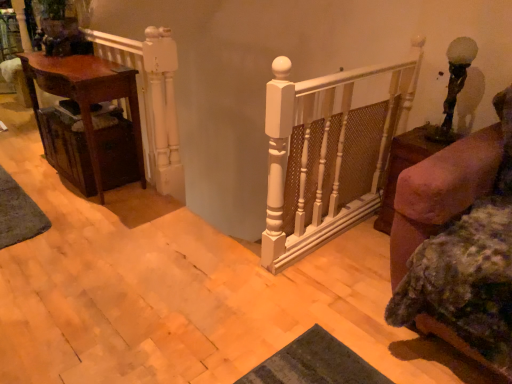
Locate an element on the screen. free space to the right of green textured mat at lower left is located at coordinates (94, 219).